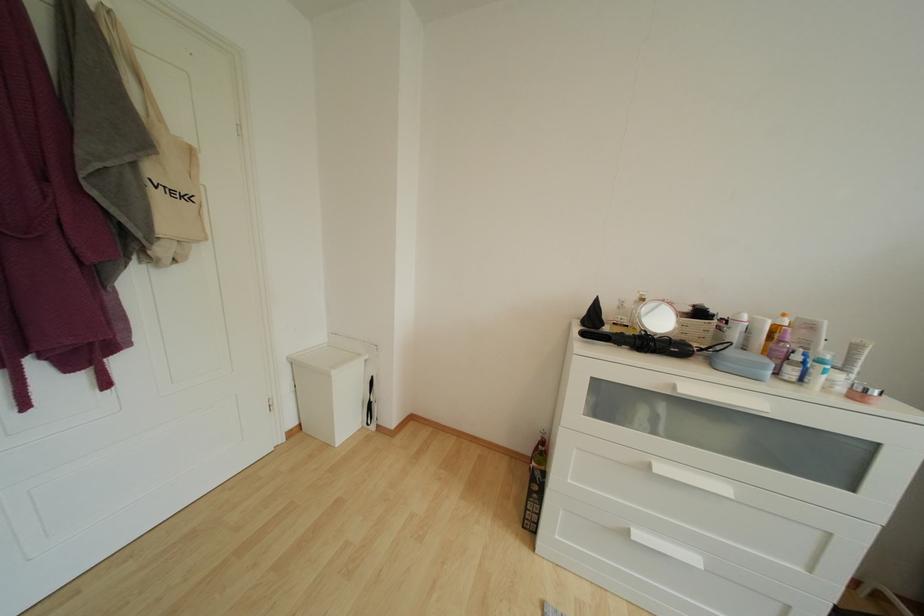
What do you see at coordinates (780, 345) in the screenshot? The height and width of the screenshot is (616, 924). I see `the purple bottle nozzle` at bounding box center [780, 345].